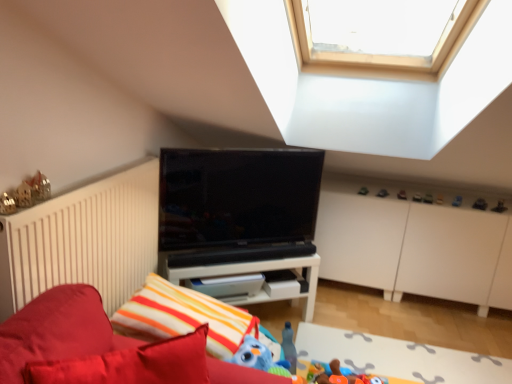
Where is `blank space to the left of matte black toy car at upper right, the fourth toy when ordered from left to right`? This screenshot has width=512, height=384. blank space to the left of matte black toy car at upper right, the fourth toy when ordered from left to right is located at coordinates click(x=362, y=189).